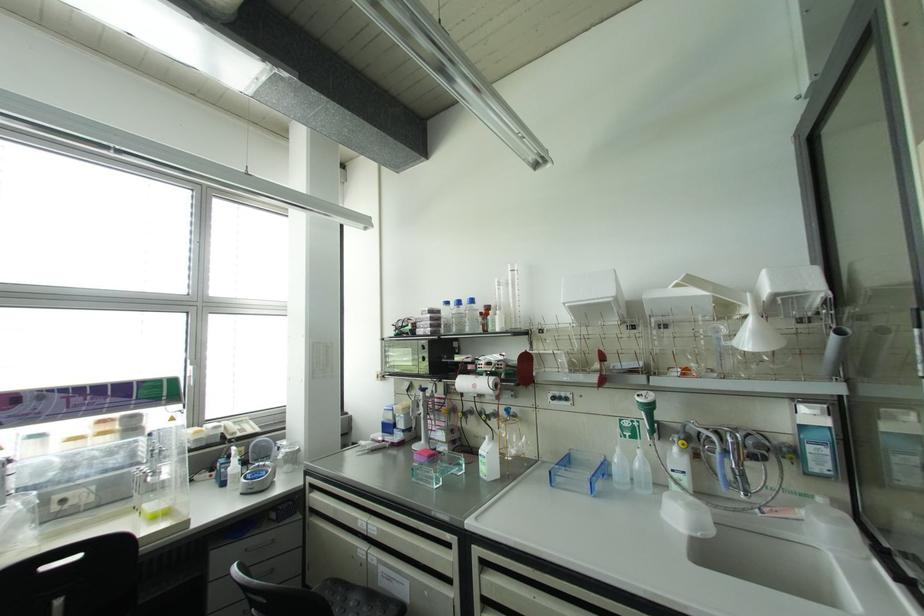
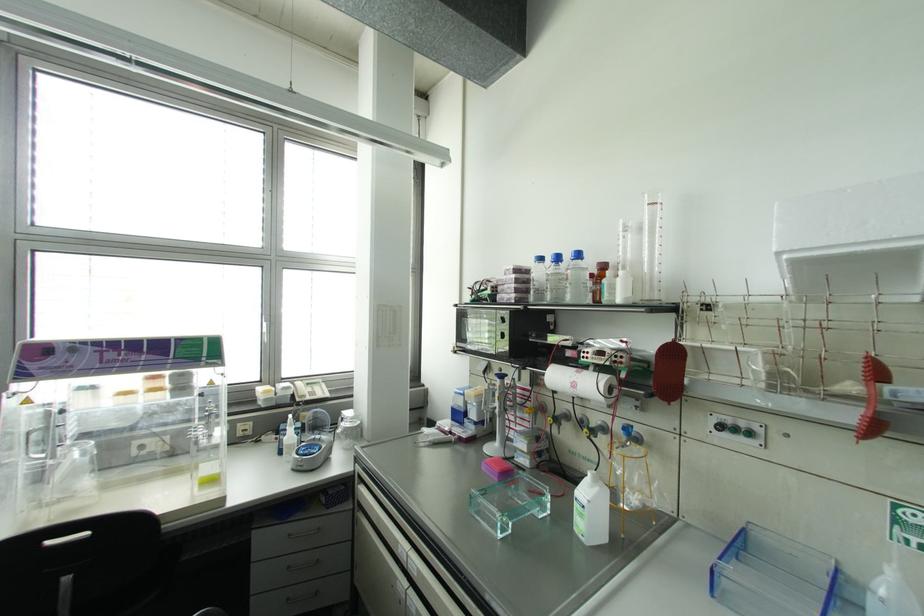
Question: What movement of the cameraman would produce the second image?

Choices:
 (A) Left
 (B) Right
 (C) Forward
 (D) Backward

Answer: (C)